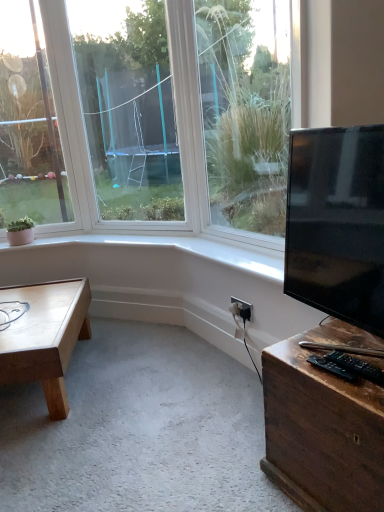
You are a GUI agent. You are given a task and a screenshot of the screen. Output one action in this format:
    pyautogui.click(x=<x>, y=<y>)
    Task: Click on the vacant region below black glossy tv at right (from a real-world perspective)
    Image resolution: width=384 pixels, height=512 pixels.
    Given the screenshot: What is the action you would take?
    pyautogui.click(x=333, y=340)